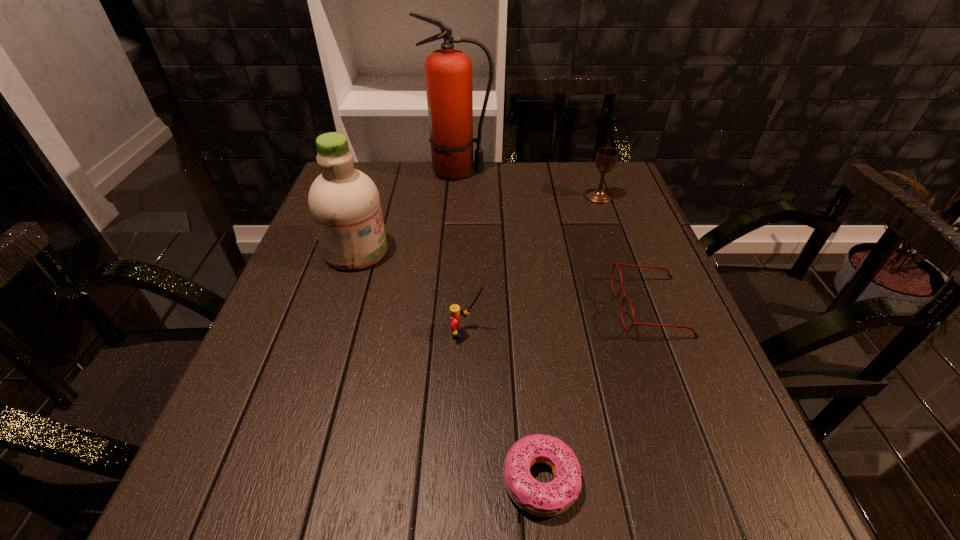
The width and height of the screenshot is (960, 540). In order to click on free region that satisfies the following two spatial constraints: 1. on the front-facing side of the fourth tallest object; 2. on the left side of the doughnut in this screenshot , I will do `click(463, 480)`.

Locate an element on the screen. free space that satisfies the following two spatial constraints: 1. on the nozzle of the fifth nearest object; 2. on the right side of the farthest object is located at coordinates (456, 197).

At what (x,y) coordinates should I click in order to perform the action: click on vacant space that satisfies the following two spatial constraints: 1. on the front-facing side of the Lego; 2. on the back side of the nearest object. Please return your answer as a coordinate pair (x, y). This screenshot has height=540, width=960. Looking at the image, I should click on (463, 480).